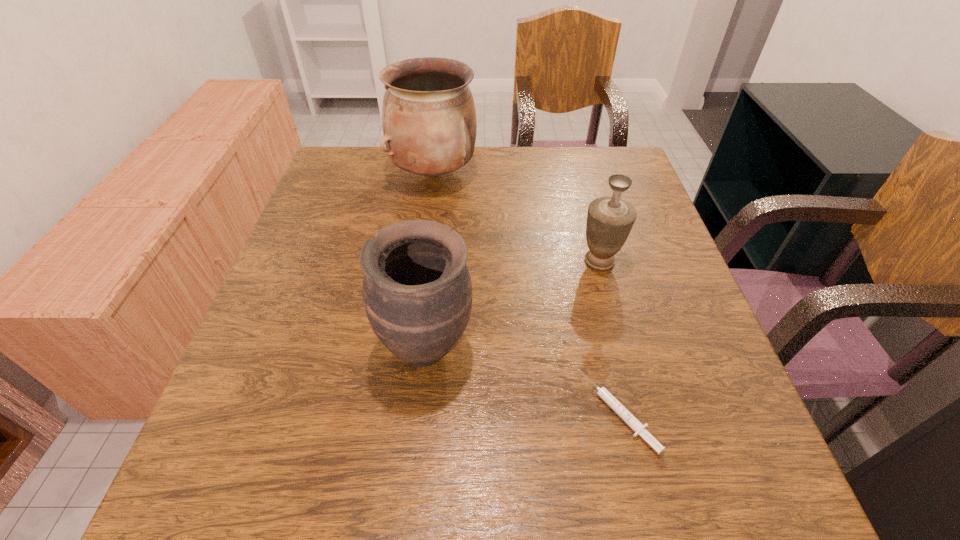
Locate an element on the screen. Image resolution: width=960 pixels, height=540 pixels. object that is at the near edge is located at coordinates (603, 393).

At what (x,y) coordinates should I click in order to perform the action: click on urn located at the right edge. Please return your answer as a coordinate pair (x, y). Looking at the image, I should click on (610, 219).

Locate an element on the screen. The height and width of the screenshot is (540, 960). syringe that is at the right edge is located at coordinates (603, 393).

Where is `object that is at the near right corner`? Image resolution: width=960 pixels, height=540 pixels. object that is at the near right corner is located at coordinates (603, 393).

Identify the location of vacant space at the far edge of the desktop. This screenshot has height=540, width=960. [x=485, y=176].

Image resolution: width=960 pixels, height=540 pixels. In order to click on free space at the near edge in this screenshot , I will do `click(359, 481)`.

Find the location of a particular element. vacant space at the left edge of the desktop is located at coordinates (237, 382).

Image resolution: width=960 pixels, height=540 pixels. What are the coordinates of `free region at the right edge` in the screenshot? It's located at (675, 298).

This screenshot has width=960, height=540. In the image, there is a desktop. In order to click on vacant space at the far left corner in this screenshot , I will do `click(339, 177)`.

I want to click on vacant area at the near left corner of the desktop, so click(218, 464).